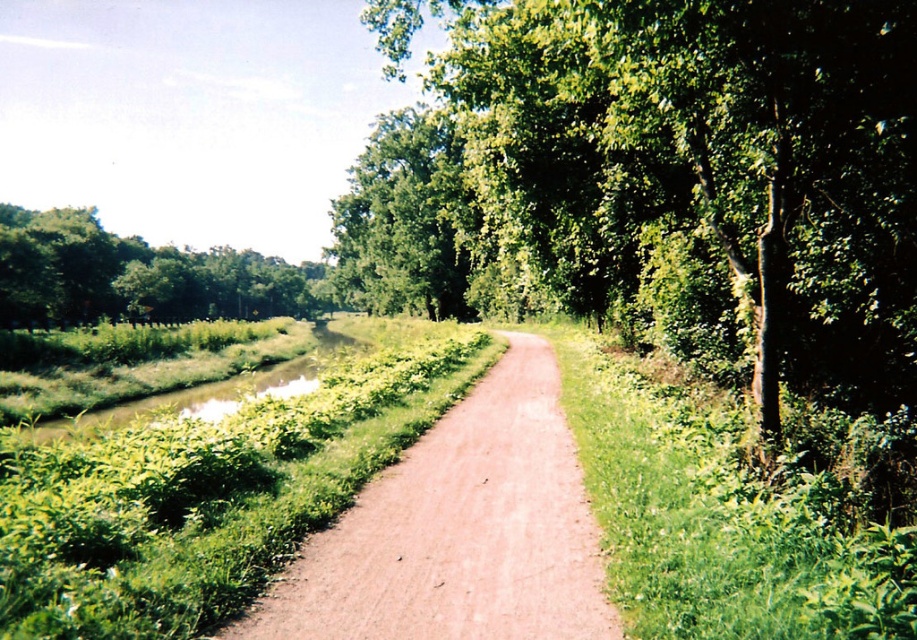
You are a hiker walking along the dirt path between the green leafy tree at center and the green grassy bank at center. Which side has a wider area?

The green grassy bank at center is wider than the green leafy tree at center.

You are a hiker standing on the dirt path and want to take a photo of the green leafy tree at center and the green leafy tree at upper left. Which tree is closer to the right side of the path?

The green leafy tree at center is positioned on the right side of green leafy tree at upper left, so the green leafy tree at center is closer to the right side of the path.